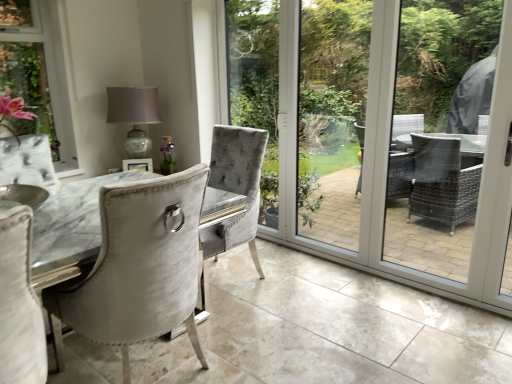
Locate an element on the screen. The width and height of the screenshot is (512, 384). vacant space to the right of satin white chair at center is located at coordinates (256, 346).